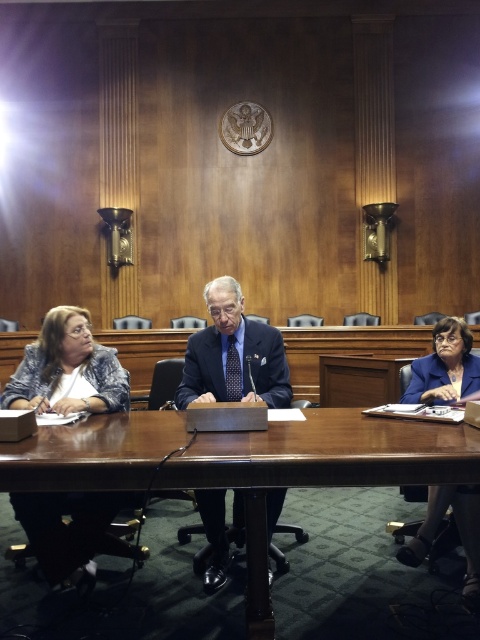
You are an observer in the room. You need to determine which of the two items, the blue textured blazer at left or the dark blue fabric suit at center, is bigger in size. Which one is larger?

The blue textured blazer at left is larger in size compared to the dark blue fabric suit at center.

You are organizing a small meeting and need to seat two people at the brown wood table at center. Considering the size of the blue fabric jacket at lower right, do you think there is enough space for both attendees?

The brown wood table at center is wider than the blue fabric jacket at lower right, so there should be sufficient space to seat two people comfortably.

You are a photographer positioned behind the long wooden table in the scene. You need to take a clear photo of both the blue textured blazer at left and the dark blue fabric suit at center. Which one will appear larger in your photo?

The blue textured blazer at left will appear larger in the photo because it is closer to the viewer than the dark blue fabric suit at center.